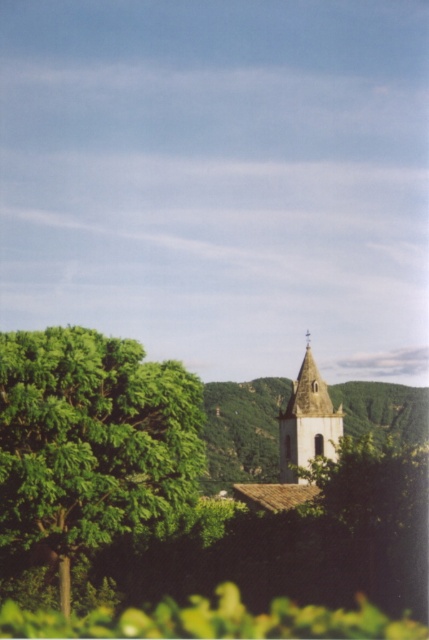
Question: Estimate the real-world distances between objects in this image. Which object is farther from the green leafy tree at left?

Choices:
 (A) light brown stone church at center
 (B) white stone tower at center

Answer: (B)

Question: From the image, what is the correct spatial relationship of green leafy tree at left in relation to white stone tower at center?

Choices:
 (A) right
 (B) left

Answer: (B)

Question: Which object appears closest to the camera in this image?

Choices:
 (A) green leafy tree at left
 (B) light brown stone church at center

Answer: (A)

Question: Is green leafy tree at left above white stone tower at center?

Choices:
 (A) yes
 (B) no

Answer: (A)

Question: Does green leafy tree at left appear over light brown stone church at center?

Choices:
 (A) yes
 (B) no

Answer: (A)

Question: Among these objects, which one is nearest to the camera?

Choices:
 (A) light brown stone church at center
 (B) green leafy tree at left
 (C) white stone tower at center

Answer: (B)